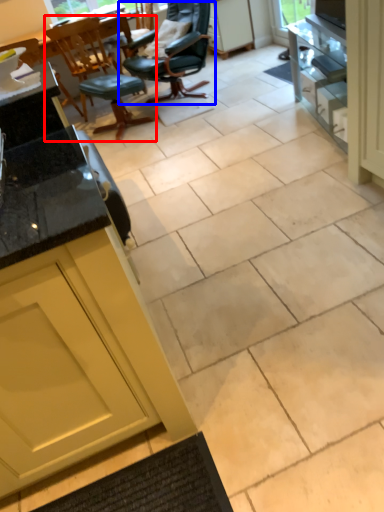
Question: Which of the following is the closest to the observer, chair (highlighted by a red box) or chair (highlighted by a blue box)?

Choices:
 (A) chair
 (B) chair

Answer: (B)